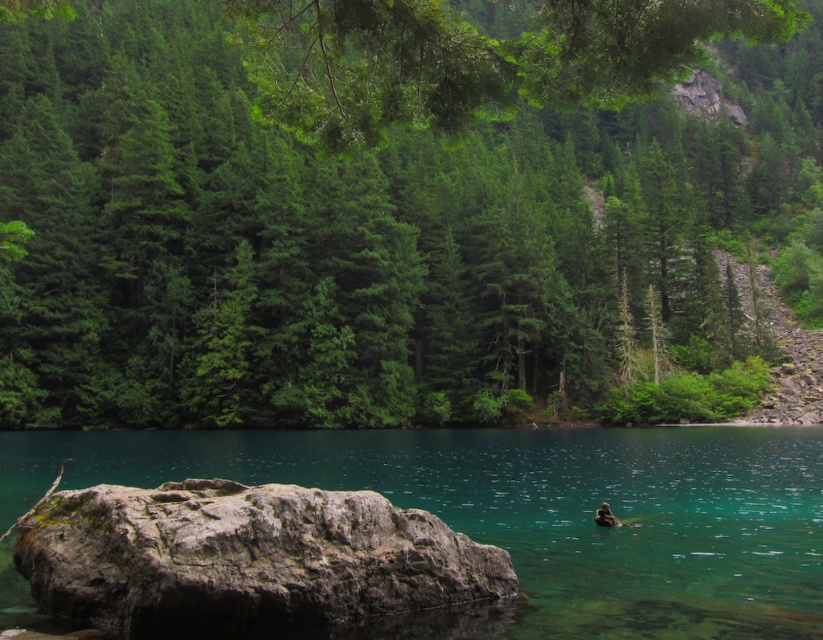
Is point (71, 134) behind point (370, 636)?

Yes, point (71, 134) is farther from viewer.

Does green matte tree at center come in front of clear glassy water at center?

Yes, it is in front of clear glassy water at center.

Find the location of a particular element. green matte tree at center is located at coordinates (396, 208).

You are a GUI agent. You are given a task and a screenshot of the screen. Output one action in this format:
    pyautogui.click(x=<x>, y=<y>)
    Task: Click on the green matte tree at center
    
    Given the screenshot: What is the action you would take?
    (396, 208)

Which of these two, green matte tree at center or gray rough rock at lower left, stands shorter?

Standing shorter between the two is gray rough rock at lower left.

Describe the element at coordinates (396, 208) in the screenshot. I see `green matte tree at center` at that location.

At what (x,y) coordinates should I click in order to perform the action: click on green matte tree at center. Please return your answer as a coordinate pair (x, y). This screenshot has width=823, height=640. Looking at the image, I should click on click(396, 208).

Identify the location of green matte tree at center. The image size is (823, 640). coord(396,208).

Does clear glassy water at center lie in front of gray rough rock at lower left?

Yes, clear glassy water at center is in front of gray rough rock at lower left.

Is point (542, 472) more distant than point (271, 580)?

Yes, it is behind point (271, 580).

At what (x,y) coordinates should I click in order to perform the action: click on clear glassy water at center. Please return your answer as a coordinate pair (x, y). The width and height of the screenshot is (823, 640). Looking at the image, I should click on (531, 515).